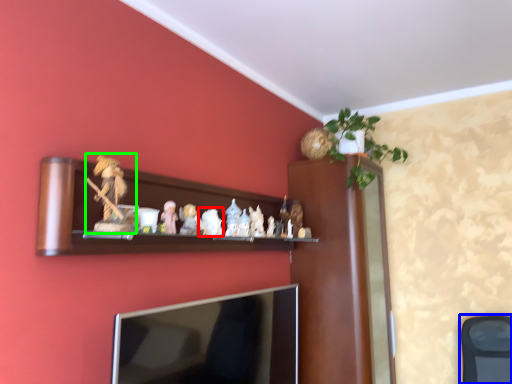
Question: Based on their relative distances, which object is nearer to toy (highlighted by a red box)? Choose from swivel chair (highlighted by a blue box) and toy (highlighted by a green box).

Choices:
 (A) swivel chair
 (B) toy

Answer: (B)